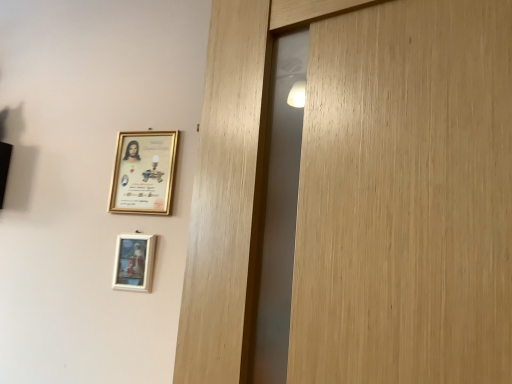
Question: Can you confirm if white matte picture frame at lower center, placed as the 1th picture frame when sorted from bottom to top, is bigger than gold-framed picture at upper left, the second picture frame when ordered from bottom to top?

Choices:
 (A) no
 (B) yes

Answer: (A)

Question: Could gold-framed picture at upper left, the second picture frame when ordered from bottom to top, be considered to be inside white matte picture frame at lower center, which appears as the second picture frame when viewed from the top?

Choices:
 (A) no
 (B) yes

Answer: (A)

Question: Considering the relative sizes of white matte picture frame at lower center, placed as the 1th picture frame when sorted from bottom to top, and gold-framed picture at upper left, the second picture frame when ordered from bottom to top, in the image provided, is white matte picture frame at lower center, placed as the 1th picture frame when sorted from bottom to top, taller than gold-framed picture at upper left, the second picture frame when ordered from bottom to top,?

Choices:
 (A) no
 (B) yes

Answer: (A)

Question: Is white matte picture frame at lower center, placed as the 1th picture frame when sorted from bottom to top, oriented towards gold-framed picture at upper left, which is the 1th picture frame from top to bottom?

Choices:
 (A) no
 (B) yes

Answer: (A)

Question: Is white matte picture frame at lower center, which appears as the second picture frame when viewed from the top, thinner than gold-framed picture at upper left, which is the 1th picture frame from top to bottom?

Choices:
 (A) no
 (B) yes

Answer: (B)

Question: Is white matte picture frame at lower center, placed as the 1th picture frame when sorted from bottom to top, at the left side of gold-framed picture at upper left, which is the 1th picture frame from top to bottom?

Choices:
 (A) yes
 (B) no

Answer: (A)

Question: Is gold-framed picture at upper left, the second picture frame when ordered from bottom to top, oriented away from white matte picture frame at lower center, placed as the 1th picture frame when sorted from bottom to top?

Choices:
 (A) no
 (B) yes

Answer: (A)

Question: Is gold-framed picture at upper left, which is the 1th picture frame from top to bottom, at the left side of white matte picture frame at lower center, placed as the 1th picture frame when sorted from bottom to top?

Choices:
 (A) no
 (B) yes

Answer: (A)

Question: From the image's perspective, is gold-framed picture at upper left, which is the 1th picture frame from top to bottom, on white matte picture frame at lower center, which appears as the second picture frame when viewed from the top?

Choices:
 (A) no
 (B) yes

Answer: (B)

Question: Considering the relative sizes of gold-framed picture at upper left, which is the 1th picture frame from top to bottom, and white matte picture frame at lower center, which appears as the second picture frame when viewed from the top, in the image provided, is gold-framed picture at upper left, which is the 1th picture frame from top to bottom, bigger than white matte picture frame at lower center, which appears as the second picture frame when viewed from the top,?

Choices:
 (A) no
 (B) yes

Answer: (B)

Question: Is gold-framed picture at upper left, which is the 1th picture frame from top to bottom, completely or partially outside of white matte picture frame at lower center, placed as the 1th picture frame when sorted from bottom to top?

Choices:
 (A) no
 (B) yes

Answer: (B)

Question: Does gold-framed picture at upper left, which is the 1th picture frame from top to bottom, appear on the right side of white matte picture frame at lower center, which appears as the second picture frame when viewed from the top?

Choices:
 (A) no
 (B) yes

Answer: (B)

Question: Looking at their shapes, would you say white matte picture frame at lower center, placed as the 1th picture frame when sorted from bottom to top, is wider or thinner than gold-framed picture at upper left, which is the 1th picture frame from top to bottom?

Choices:
 (A) wide
 (B) thin

Answer: (B)